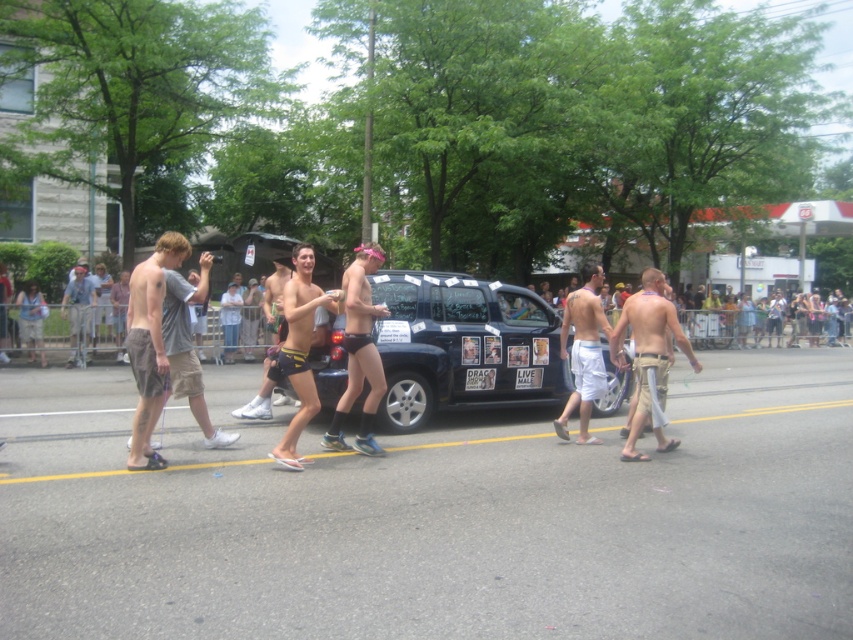
Question: Among these points, which one is farthest from the camera?

Choices:
 (A) [x=585, y=429]
 (B) [x=469, y=316]
 (C) [x=483, y=378]

Answer: (B)

Question: Is black matte car at center below white paper sign at center?

Choices:
 (A) yes
 (B) no

Answer: (B)

Question: Which point is closer to the camera?

Choices:
 (A) (525, 328)
 (B) (136, 433)
 (C) (73, 342)

Answer: (B)

Question: Can you confirm if matte black underwear at center is positioned above light blue denim shorts at left?

Choices:
 (A) yes
 (B) no

Answer: (A)

Question: Which of the following is the closest to the observer?

Choices:
 (A) white plastic sign at center
 (B) tan fabric shorts at right
 (C) light blue denim shorts at left

Answer: (B)

Question: Does gray cotton shorts at left lie in front of white plastic sign at center?

Choices:
 (A) yes
 (B) no

Answer: (A)